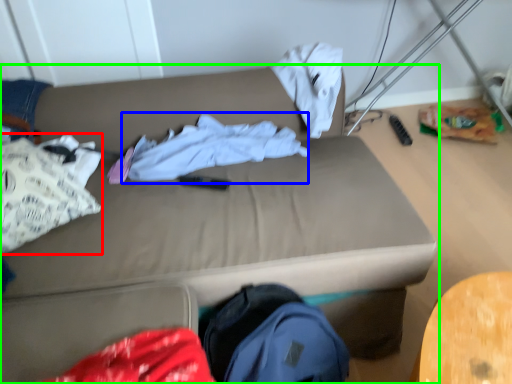
Question: Which is farther away from clothing (highlighted by a red box)? clothing (highlighted by a blue box) or studio couch (highlighted by a green box)?

Choices:
 (A) clothing
 (B) studio couch

Answer: (A)